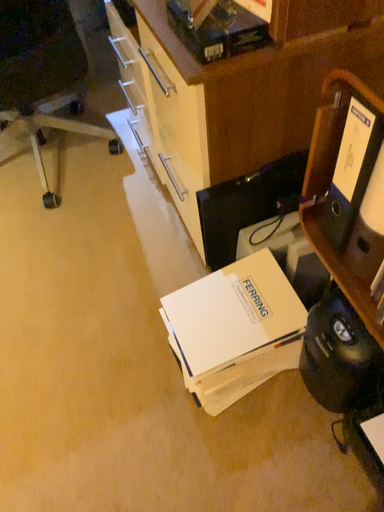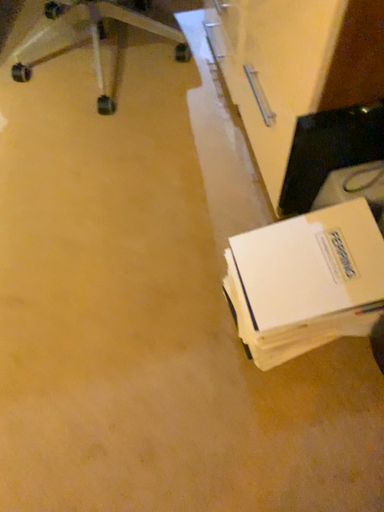
Question: How did the camera likely rotate when shooting the video?

Choices:
 (A) rotated upward
 (B) rotated downward

Answer: (B)